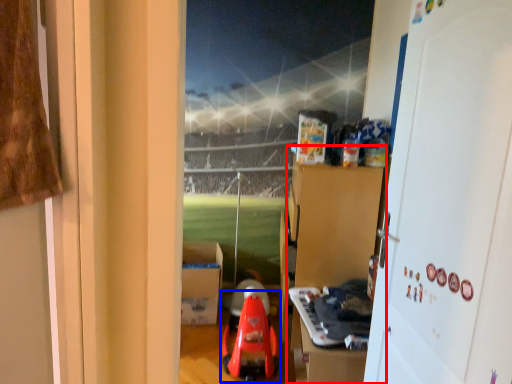
Question: Which object is closer to the camera taking this photo, dresser (highlighted by a red box) or toy (highlighted by a blue box)?

Choices:
 (A) dresser
 (B) toy

Answer: (B)